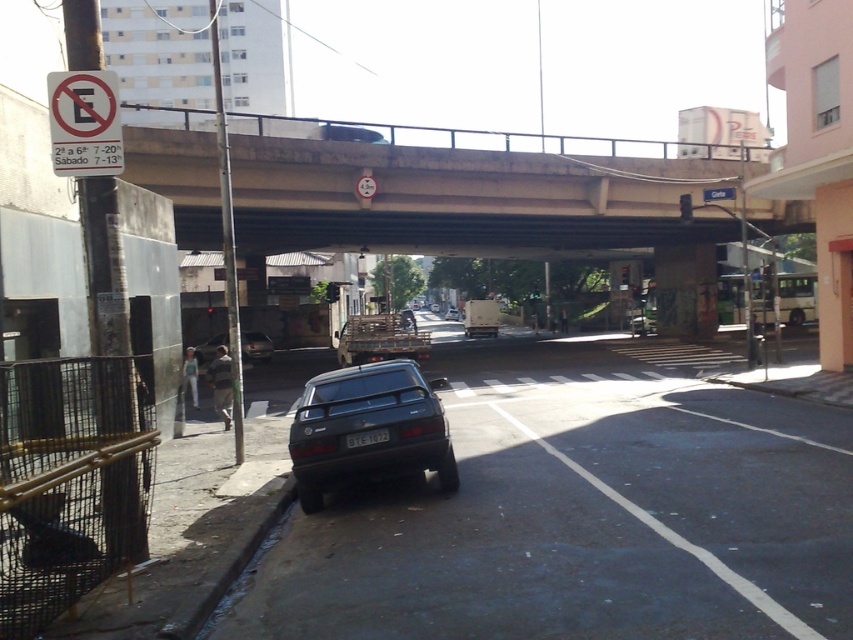
You are a delivery driver who needs to park your van near the white plastic sign at upper left. The van is 7 meters long. The parking space available is 6 meters long. Can you park your van here?

The parking space available is 6 meters long, which is shorter than the van that is 7 meters long. Therefore, you cannot park your van here.

You are a delivery driver who needs to park your truck near the concrete bridge at center and the green plastic traffic sign at center. The truck requires a parking space of at least 15 meters in length. Can you park your truck between these two objects?

The concrete bridge at center is 17.26 meters away from the green plastic traffic sign at center. Since the distance between them is greater than the truck requires, you can park your truck between these two objects.